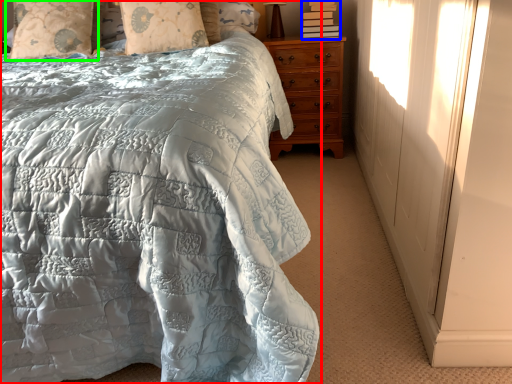
Question: Which object is the closest to the bed (highlighted by a red box)? Choose among these: book (highlighted by a blue box) or pillow (highlighted by a green box).

Choices:
 (A) book
 (B) pillow

Answer: (B)